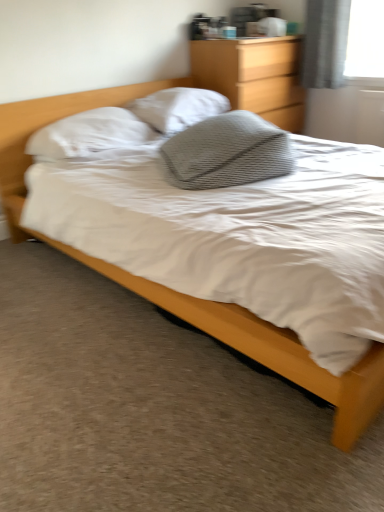
Question: Considering the relative sizes of gray textured pillow at center, which is counted as the 1th pillow, starting from the front, and white soft pillow at upper left, which ranks as the 2th pillow in front-to-back order, in the image provided, is gray textured pillow at center, which is counted as the 1th pillow, starting from the front, wider than white soft pillow at upper left, which ranks as the 2th pillow in front-to-back order,?

Choices:
 (A) no
 (B) yes

Answer: (B)

Question: Is gray textured pillow at center, which is counted as the 1th pillow, starting from the front, to the right of white soft pillow at upper left, which is counted as the 2th pillow, starting from the back, from the viewer's perspective?

Choices:
 (A) yes
 (B) no

Answer: (A)

Question: From the image's perspective, is gray textured pillow at center, the third pillow when ordered from back to front, below white soft pillow at upper left, which ranks as the 2th pillow in front-to-back order?

Choices:
 (A) no
 (B) yes

Answer: (B)

Question: Does gray textured pillow at center, the third pillow when ordered from back to front, appear on the left side of white soft pillow at upper left, which is counted as the 2th pillow, starting from the back?

Choices:
 (A) no
 (B) yes

Answer: (A)

Question: Can you confirm if gray textured pillow at center, the third pillow when ordered from back to front, is bigger than white soft pillow at upper left, which ranks as the 2th pillow in front-to-back order?

Choices:
 (A) yes
 (B) no

Answer: (A)

Question: Does point coord(46,138) appear closer or farther from the camera than point coord(125,90)?

Choices:
 (A) closer
 (B) farther

Answer: (A)

Question: Would you say white soft pillow at upper left, which ranks as the 2th pillow in front-to-back order, is inside or outside matte wood bed at center?

Choices:
 (A) outside
 (B) inside

Answer: (B)

Question: Is white soft pillow at upper left, which is counted as the 2th pillow, starting from the back, bigger or smaller than matte wood bed at center?

Choices:
 (A) small
 (B) big

Answer: (A)

Question: Looking at their shapes, would you say white soft pillow at upper left, which is counted as the 2th pillow, starting from the back, is wider or thinner than matte wood bed at center?

Choices:
 (A) wide
 (B) thin

Answer: (B)

Question: Based on their sizes in the image, would you say white textured pillow at center, arranged as the 1th pillow when viewed from the back, is bigger or smaller than white soft pillow at upper left, which is counted as the 2th pillow, starting from the back?

Choices:
 (A) small
 (B) big

Answer: (B)

Question: Would you say white textured pillow at center, which is the 3th pillow in front-to-back order, is inside or outside white soft pillow at upper left, which ranks as the 2th pillow in front-to-back order?

Choices:
 (A) outside
 (B) inside

Answer: (A)

Question: From the image's perspective, is white textured pillow at center, which is the 3th pillow in front-to-back order, above or below white soft pillow at upper left, which ranks as the 2th pillow in front-to-back order?

Choices:
 (A) below
 (B) above

Answer: (B)

Question: Considering the positions of point (158, 93) and point (77, 143), is point (158, 93) closer or farther from the camera than point (77, 143)?

Choices:
 (A) farther
 (B) closer

Answer: (A)

Question: Is point (48, 153) closer or farther from the camera than point (180, 93)?

Choices:
 (A) closer
 (B) farther

Answer: (A)

Question: Which is correct: white soft pillow at upper left, which is counted as the 2th pillow, starting from the back, is inside white textured pillow at center, arranged as the 1th pillow when viewed from the back, or outside of it?

Choices:
 (A) inside
 (B) outside

Answer: (B)